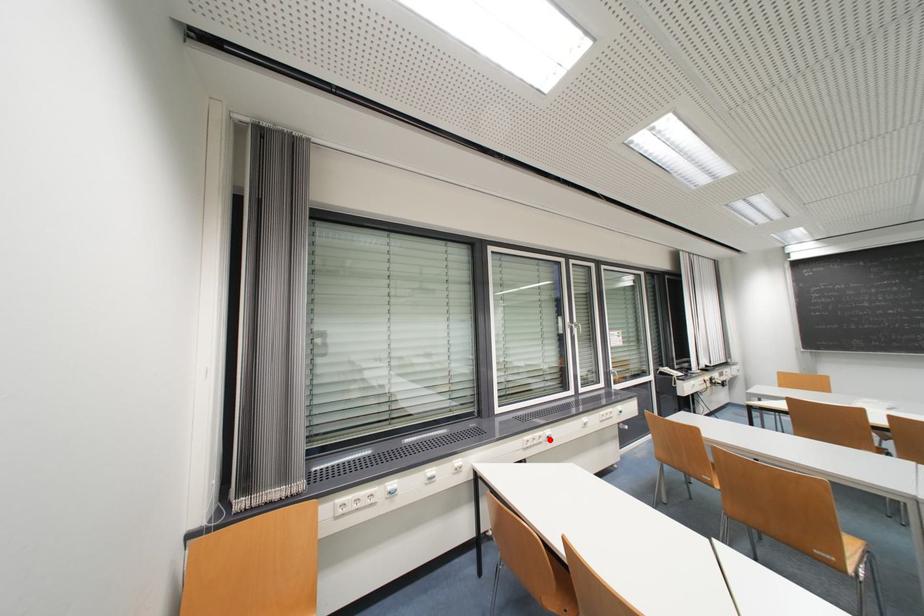
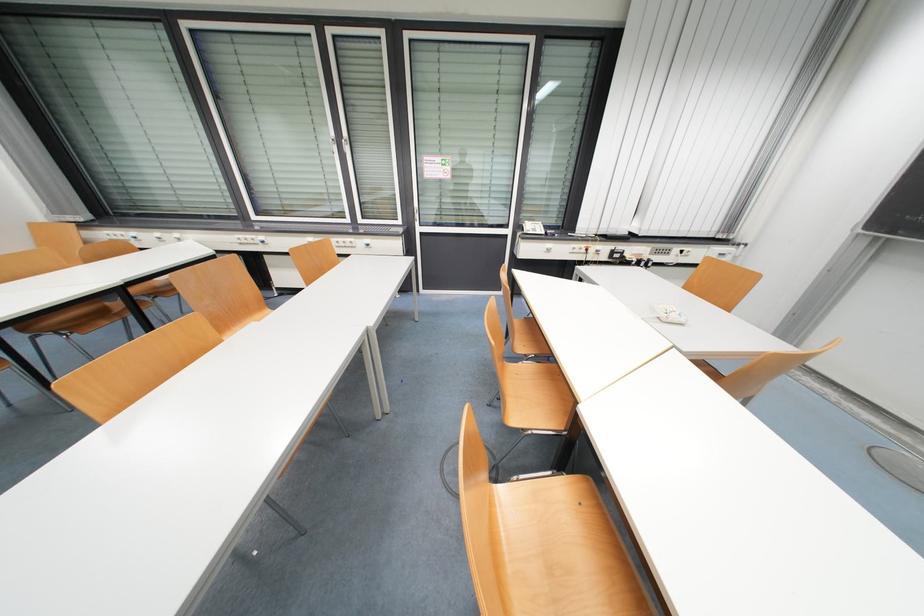
Where in the second image is the point corresponding to the highlighted location from the first image?

(262, 243)